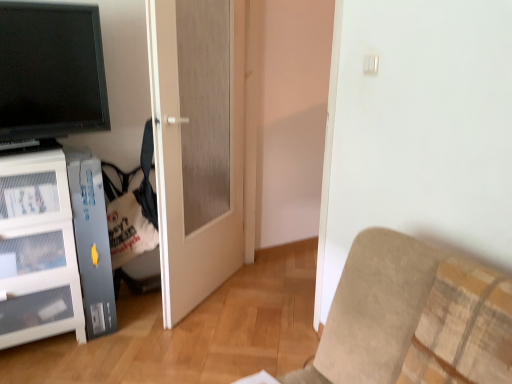
In order to face beige fabric couch at lower right, should I rotate leftwards or rightwards?

You should look right and rotate roughly 12.521 degrees.

Describe the element at coordinates (197, 145) in the screenshot. The width and height of the screenshot is (512, 384). I see `matte white door at center` at that location.

Describe the element at coordinates (51, 71) in the screenshot. I see `matte black tv at upper left` at that location.

Image resolution: width=512 pixels, height=384 pixels. In order to click on beige fabric couch at lower right in this screenshot , I will do `click(411, 319)`.

Considering the relative positions of matte black tv at upper left and beige fabric couch at lower right in the image provided, is matte black tv at upper left behind beige fabric couch at lower right?

Yes, matte black tv at upper left is further from the viewer.

From the picture: Looking at their sizes, would you say matte black tv at upper left is wider or thinner than beige fabric couch at lower right?

Clearly, matte black tv at upper left has less width compared to beige fabric couch at lower right.

Between matte black tv at upper left and beige fabric couch at lower right, which one has larger size?

Bigger between the two is beige fabric couch at lower right.

Which of these two, matte black tv at upper left or beige fabric couch at lower right, stands taller?

With more height is matte black tv at upper left.

Is matte white door at center oriented away from beige fabric couch at lower right?

No.

Considering the relative positions of matte white door at center and beige fabric couch at lower right in the image provided, is matte white door at center to the right of beige fabric couch at lower right from the viewer's perspective?

In fact, matte white door at center is to the left of beige fabric couch at lower right.

From a real-world perspective, is matte white door at center over beige fabric couch at lower right?

Indeed, from a real-world perspective, matte white door at center stands above beige fabric couch at lower right.

In the scene shown: Considering the sizes of objects matte white door at center and beige fabric couch at lower right in the image provided, who is bigger, matte white door at center or beige fabric couch at lower right?

With larger size is beige fabric couch at lower right.

Is matte black tv at upper left oriented towards matte white door at center?

No, matte black tv at upper left is not aimed at matte white door at center.

From the image's perspective, relative to matte white door at center, is matte black tv at upper left above or below?

matte black tv at upper left is above matte white door at center.

Considering the relative sizes of matte black tv at upper left and matte white door at center in the image provided, is matte black tv at upper left shorter than matte white door at center?

Yes.

Which is behind, beige fabric couch at lower right or matte black tv at upper left?

matte black tv at upper left is further from the camera.

How different are the orientations of beige fabric couch at lower right and matte black tv at upper left in degrees?

There is a 97.5-degree angle between the facing directions of beige fabric couch at lower right and matte black tv at upper left.

Considering the relative sizes of beige fabric couch at lower right and matte black tv at upper left in the image provided, is beige fabric couch at lower right shorter than matte black tv at upper left?

Indeed, beige fabric couch at lower right has a lesser height compared to matte black tv at upper left.

Can you confirm if beige fabric couch at lower right is smaller than matte black tv at upper left?

No, beige fabric couch at lower right is not smaller than matte black tv at upper left.

Can you confirm if beige fabric couch at lower right is wider than matte white door at center?

Correct, the width of beige fabric couch at lower right exceeds that of matte white door at center.

Is beige fabric couch at lower right not inside matte white door at center?

beige fabric couch at lower right lies outside matte white door at center's area.

Between beige fabric couch at lower right and matte white door at center, which one has smaller size?

matte white door at center is smaller.

Find the location of a particular element. The image size is (512, 384). furniture in front of the matte white door at center is located at coordinates (411, 319).

At what (x,y) coordinates should I click in order to perform the action: click on television positioned vertically above the matte white door at center (from a real-world perspective). Please return your answer as a coordinate pair (x, y). Image resolution: width=512 pixels, height=384 pixels. Looking at the image, I should click on (51, 71).

From the image's perspective, which is below, matte white door at center or matte black tv at upper left?

From the image's view, matte white door at center is below.

Does matte white door at center touch matte black tv at upper left?

No, matte white door at center is not in contact with matte black tv at upper left.

Locate an element on the screen. The image size is (512, 384). furniture below the matte black tv at upper left (from the image's perspective) is located at coordinates (411, 319).

Where is `furniture located on the right of matte white door at center`? furniture located on the right of matte white door at center is located at coordinates (411, 319).

Looking at the image, which one is located closer to matte white door at center, matte black tv at upper left or beige fabric couch at lower right?

matte black tv at upper left lies closer to matte white door at center than the other object.

Which object lies nearer to the anchor point matte black tv at upper left, beige fabric couch at lower right or matte white door at center?

Among the two, matte white door at center is located nearer to matte black tv at upper left.

Based on their spatial positions, is beige fabric couch at lower right or matte black tv at upper left further from matte white door at center?

beige fabric couch at lower right lies further to matte white door at center than the other object.

When comparing their distances from beige fabric couch at lower right, does matte black tv at upper left or matte white door at center seem further?

Among the two, matte black tv at upper left is located further to beige fabric couch at lower right.

Estimate the real-world distances between objects in this image. Which object is closer to matte black tv at upper left, matte white door at center or beige fabric couch at lower right?

matte white door at center.

Which object lies nearer to the anchor point beige fabric couch at lower right, matte white door at center or matte black tv at upper left?

Based on the image, matte white door at center appears to be nearer to beige fabric couch at lower right.

The height and width of the screenshot is (384, 512). Identify the location of television between beige fabric couch at lower right and matte white door at center along the z-axis. (51, 71).